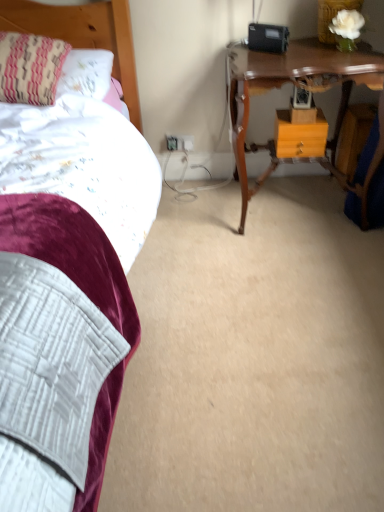
The height and width of the screenshot is (512, 384). I want to click on wooden table at upper right, so click(295, 85).

Find the location of a particular element. Image resolution: width=384 pixels, height=512 pixels. wooden headboard at upper left is located at coordinates (83, 35).

What is the approximate height of wooden headboard at upper left?

wooden headboard at upper left is 14.12 inches tall.

You are a GUI agent. You are given a task and a screenshot of the screen. Output one action in this format:
    pyautogui.click(x=<x>, y=<y>)
    Task: Click on the striped fabric pillow at upper left
    
    Given the screenshot: What is the action you would take?
    [x=30, y=67]

Which of these two, orange matte drawer at center or wooden headboard at upper left, is wider?

With larger width is wooden headboard at upper left.

Considering the relative sizes of orange matte drawer at center and wooden headboard at upper left in the image provided, is orange matte drawer at center shorter than wooden headboard at upper left?

Yes.

Considering the positions of objects orange matte drawer at center and wooden headboard at upper left in the image provided, who is more to the right, orange matte drawer at center or wooden headboard at upper left?

Positioned to the right is orange matte drawer at center.

Is orange matte drawer at center touching wooden headboard at upper left?

No, orange matte drawer at center is not touching wooden headboard at upper left.

Is wooden table at upper right oriented away from wooden headboard at upper left?

wooden table at upper right does not have its back to wooden headboard at upper left.

Based on their sizes in the image, would you say wooden table at upper right is bigger or smaller than wooden headboard at upper left?

Clearly, wooden table at upper right is larger in size than wooden headboard at upper left.

Between point (373, 82) and point (23, 3), which one is positioned behind?

The point (23, 3) is behind.

From a real-world perspective, is wooden table at upper right under wooden headboard at upper left?

Correct, in the physical world, wooden table at upper right is lower than wooden headboard at upper left.

Can you confirm if wooden table at upper right is taller than striped fabric pillow at upper left?

Yes.

From a real-world perspective, who is located lower, wooden table at upper right or striped fabric pillow at upper left?

wooden table at upper right, from a real-world perspective.

Is wooden table at upper right at the left side of striped fabric pillow at upper left?

In fact, wooden table at upper right is to the right of striped fabric pillow at upper left.

Is wooden table at upper right turned away from striped fabric pillow at upper left?

wooden table at upper right does not have its back to striped fabric pillow at upper left.

Considering the relative positions of wooden headboard at upper left and orange matte drawer at center in the image provided, is wooden headboard at upper left in front of orange matte drawer at center?

Yes.

From the image's perspective, which object appears higher, wooden headboard at upper left or orange matte drawer at center?

wooden headboard at upper left is shown above in the image.

Would you consider wooden headboard at upper left to be distant from orange matte drawer at center?

That's not correct — wooden headboard at upper left is a little close to orange matte drawer at center.

In the image, there is a wooden headboard at upper left. At what (x,y) coordinates should I click in order to perform the action: click on nightstand below it (from the image's perspective). Please return your answer as a coordinate pair (x, y). The image size is (384, 512). Looking at the image, I should click on (299, 136).

Looking at this image, who is more distant, striped fabric pillow at upper left or orange matte drawer at center?

orange matte drawer at center is further from the camera.

Is striped fabric pillow at upper left taller or shorter than orange matte drawer at center?

striped fabric pillow at upper left is taller than orange matte drawer at center.

Find the location of `pillow on the left of orange matte drawer at center`. pillow on the left of orange matte drawer at center is located at coordinates (30, 67).

From the image's perspective, is striped fabric pillow at upper left above orange matte drawer at center?

Yes, from the image's perspective, striped fabric pillow at upper left is over orange matte drawer at center.

Looking at this image, how different are the orientations of wooden headboard at upper left and wooden table at upper right in degrees?

1.09 degrees separate the facing orientations of wooden headboard at upper left and wooden table at upper right.

Considering the sizes of objects wooden headboard at upper left and wooden table at upper right in the image provided, who is bigger, wooden headboard at upper left or wooden table at upper right?

Bigger between the two is wooden table at upper right.

Is wooden headboard at upper left not close to wooden table at upper right?

No, there isn't a large distance between wooden headboard at upper left and wooden table at upper right.

In terms of height, does wooden headboard at upper left look taller or shorter compared to wooden table at upper right?

Clearly, wooden headboard at upper left is shorter compared to wooden table at upper right.

Considering the points (14, 75) and (355, 60), which point is behind, point (14, 75) or point (355, 60)?

The point (355, 60) is behind.

Is striped fabric pillow at upper left in contact with wooden table at upper right?

No, striped fabric pillow at upper left is not making contact with wooden table at upper right.

Is striped fabric pillow at upper left inside the boundaries of wooden table at upper right, or outside?

striped fabric pillow at upper left exists outside the volume of wooden table at upper right.

This screenshot has width=384, height=512. Find the location of `nightstand below the wooden headboard at upper left (from a real-world perspective)`. nightstand below the wooden headboard at upper left (from a real-world perspective) is located at coordinates (299, 136).

Where is `table in front of the wooden headboard at upper left`? This screenshot has height=512, width=384. table in front of the wooden headboard at upper left is located at coordinates (295, 85).

Considering their positions, is striped fabric pillow at upper left positioned further to wooden headboard at upper left than orange matte drawer at center?

orange matte drawer at center lies further to wooden headboard at upper left than the other object.

Considering their positions, is orange matte drawer at center positioned closer to striped fabric pillow at upper left than wooden headboard at upper left?

The object closer to striped fabric pillow at upper left is wooden headboard at upper left.

Which object lies further to the anchor point striped fabric pillow at upper left, wooden table at upper right or orange matte drawer at center?

orange matte drawer at center lies further to striped fabric pillow at upper left than the other object.

Considering their positions, is wooden table at upper right positioned closer to orange matte drawer at center than striped fabric pillow at upper left?

Among the two, wooden table at upper right is located nearer to orange matte drawer at center.

Considering their positions, is orange matte drawer at center positioned closer to wooden table at upper right than striped fabric pillow at upper left?

orange matte drawer at center lies closer to wooden table at upper right than the other object.

Which object lies further to the anchor point wooden table at upper right, striped fabric pillow at upper left or wooden headboard at upper left?

striped fabric pillow at upper left is further to wooden table at upper right.

From the image, which object appears to be nearer to wooden headboard at upper left, wooden table at upper right or striped fabric pillow at upper left?

striped fabric pillow at upper left is positioned closer to the anchor wooden headboard at upper left.

Estimate the real-world distances between objects in this image. Which object is further from wooden headboard at upper left, orange matte drawer at center or striped fabric pillow at upper left?

orange matte drawer at center.

Locate an element on the screen. This screenshot has height=512, width=384. table between wooden headboard at upper left and orange matte drawer at center in the horizontal direction is located at coordinates (295, 85).

Where is `headboard between striped fabric pillow at upper left and orange matte drawer at center in the horizontal direction`? The height and width of the screenshot is (512, 384). headboard between striped fabric pillow at upper left and orange matte drawer at center in the horizontal direction is located at coordinates (83, 35).

You are a GUI agent. You are given a task and a screenshot of the screen. Output one action in this format:
    pyautogui.click(x=<x>, y=<y>)
    Task: Click on the table between striped fabric pillow at upper left and orange matte drawer at center
    This screenshot has width=384, height=512.
    Given the screenshot: What is the action you would take?
    pyautogui.click(x=295, y=85)

I want to click on headboard located between striped fabric pillow at upper left and wooden table at upper right in the left-right direction, so click(83, 35).